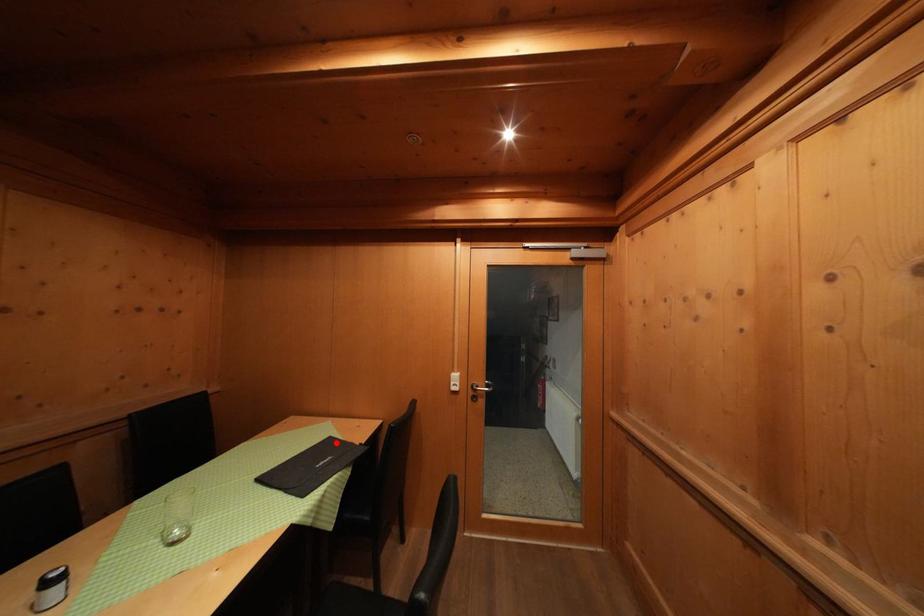
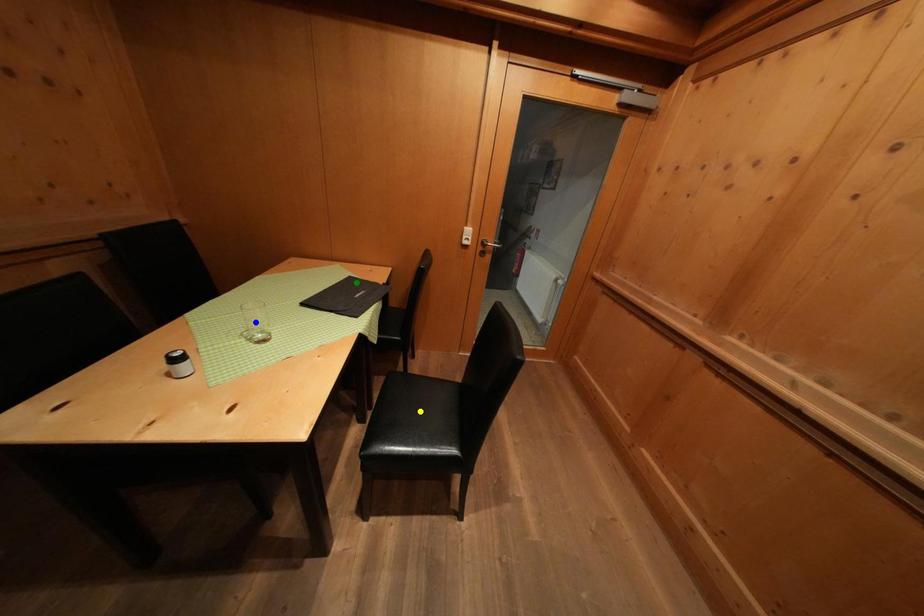
Question: I am providing you with two images of the same scene from different viewpoints. A red point is marked on the first image. You are given multiple points on the second image. Which point in image 2 is actually the same real-world point as the red point in image 1?

Choices:
 (A) blue point
 (B) yellow point
 (C) green point

Answer: (C)